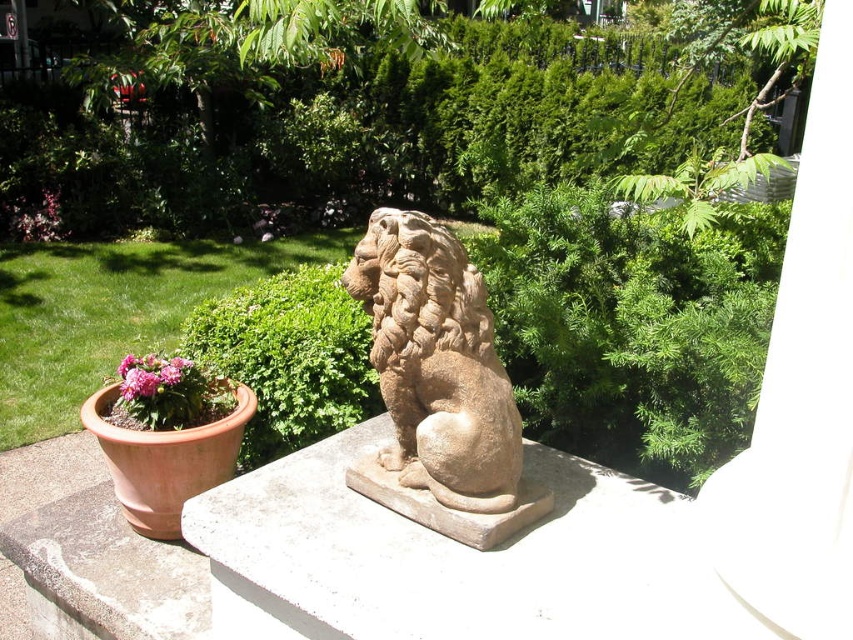
In the garden scene, there is a green leafy bush at center and a pink matte flower at lower left. Which of these two objects is wider?

The green leafy bush at center is wider than the pink matte flower at lower left.

You are standing in the garden and want to place a small decorative item exactly at the center of the green leafy bush at center. According to the coordinates provided, where should you place the item?

The small decorative item should be placed at the coordinates point (288, 356), which is the 2D location of the green leafy bush at center.

You are a landscape architect designing a garden layout. You have a brown stone lion at center and a green leafy bush at center. Which object should you place closer to the entrance to ensure the entrance area doesn not look too crowded?

The brown stone lion at center is smaller than the green leafy bush at center, so placing the smaller brown stone lion at center closer to the entrance would prevent overcrowding while still maintaining visual interest.